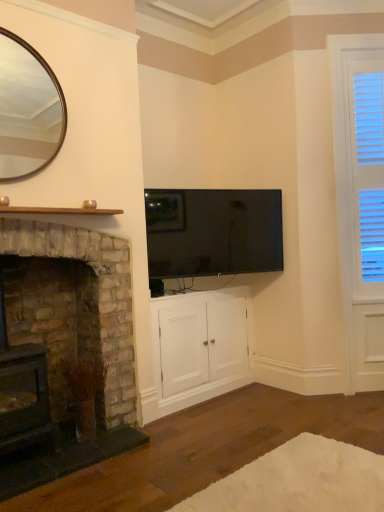
The width and height of the screenshot is (384, 512). I want to click on white wood cabinet at center, so click(x=199, y=347).

Describe the element at coordinates (70, 331) in the screenshot. I see `rustic stone fireplace at left, which is counted as the 2th fireplace, starting from the left` at that location.

This screenshot has width=384, height=512. Describe the element at coordinates (156, 287) in the screenshot. I see `black plastic phone at lower center` at that location.

What is the approximate height of gold-framed mirror at upper left?

gold-framed mirror at upper left is 33.45 inches in height.

This screenshot has height=512, width=384. I want to click on gold-framed mirror at upper left, so click(x=28, y=110).

At what (x,y) coordinates should I click in order to perform the action: click on white fluffy rug at lower center. Please return your answer as a coordinate pair (x, y). This screenshot has height=512, width=384. Looking at the image, I should click on (298, 480).

Is flat-screen black tv at upper center next to black plastic phone at lower center and touching it?

flat-screen black tv at upper center is not next to black plastic phone at lower center, and they're not touching.

Does flat-screen black tv at upper center have a lesser width compared to black plastic phone at lower center?

Yes.

Does flat-screen black tv at upper center contain black plastic phone at lower center?

No, black plastic phone at lower center is located outside of flat-screen black tv at upper center.

Is flat-screen black tv at upper center oriented away from black plastic phone at lower center?

Yes, flat-screen black tv at upper center's orientation is away from black plastic phone at lower center.

Relative to white fluffy rug at lower center, is gold-framed mirror at upper left in front or behind?

gold-framed mirror at upper left is behind white fluffy rug at lower center.

Is the surface of gold-framed mirror at upper left in direct contact with white fluffy rug at lower center?

No, gold-framed mirror at upper left is not beside white fluffy rug at lower center.

From their relative heights in the image, would you say gold-framed mirror at upper left is taller or shorter than white fluffy rug at lower center?

Considering their sizes, gold-framed mirror at upper left has more height than white fluffy rug at lower center.

Considering the relative positions of white wood blinds at right and flat-screen black tv at upper center in the image provided, is white wood blinds at right behind flat-screen black tv at upper center?

Yes.

Does white wood blinds at right turn towards flat-screen black tv at upper center?

No, white wood blinds at right is not aimed at flat-screen black tv at upper center.

Find the location of a particular element. This screenshot has height=512, width=384. window frame behind the flat-screen black tv at upper center is located at coordinates (360, 199).

Which is closer, (x=368, y=362) or (x=171, y=207)?

Point (x=368, y=362) is farther from the camera than point (x=171, y=207).

Can you confirm if rustic stone fireplace at left, acting as the second fireplace starting from the right, is positioned to the left of white fluffy rug at lower center?

Indeed, rustic stone fireplace at left, acting as the second fireplace starting from the right, is positioned on the left side of white fluffy rug at lower center.

Is rustic stone fireplace at left, the first fireplace in the left-to-right sequence, facing away from white fluffy rug at lower center?

No, rustic stone fireplace at left, the first fireplace in the left-to-right sequence,'s orientation is not away from white fluffy rug at lower center.

Considering the relative positions of rustic stone fireplace at left, acting as the second fireplace starting from the right, and white fluffy rug at lower center in the image provided, is rustic stone fireplace at left, acting as the second fireplace starting from the right, behind white fluffy rug at lower center?

Yes, it is.

Considering the sizes of flat-screen black tv at upper center and gold-framed mirror at upper left in the image, is flat-screen black tv at upper center taller or shorter than gold-framed mirror at upper left?

Considering their sizes, flat-screen black tv at upper center has less height than gold-framed mirror at upper left.

Is flat-screen black tv at upper center not near gold-framed mirror at upper left?

Yes, flat-screen black tv at upper center and gold-framed mirror at upper left are located far from each other.

Relative to gold-framed mirror at upper left, is flat-screen black tv at upper center in front or behind?

Visually, flat-screen black tv at upper center is located behind gold-framed mirror at upper left.

Does point (219, 225) appear closer or farther from the camera than point (31, 115)?

Point (219, 225) is closer to the camera than point (31, 115).

From the image's perspective, who appears lower, white fluffy rug at lower center or white wood blinds at right?

white fluffy rug at lower center appears lower in the image.

From a real-world perspective, between white fluffy rug at lower center and white wood blinds at right, who is vertically lower?

white fluffy rug at lower center, from a real-world perspective.

Does white fluffy rug at lower center have a larger size compared to white wood blinds at right?

No.

Which of these two, white fluffy rug at lower center or white wood blinds at right, stands shorter?

white fluffy rug at lower center.

The height and width of the screenshot is (512, 384). What are the coordinates of `the 1st fireplace counting from the left side of the white wood blinds at right` in the screenshot? It's located at (70, 331).

Is rustic stone fireplace at left, the 1th fireplace positioned from the right, in front of or behind white wood blinds at right in the image?

Clearly, rustic stone fireplace at left, the 1th fireplace positioned from the right, is in front of white wood blinds at right.

From the image's perspective, is rustic stone fireplace at left, which is counted as the 2th fireplace, starting from the left, located above white wood blinds at right?

No, from the image's perspective, rustic stone fireplace at left, which is counted as the 2th fireplace, starting from the left, is not on top of white wood blinds at right.

Is point (80, 250) positioned in front of point (340, 250)?

Yes, it is.

At what (x,y) coordinates should I click in order to perform the action: click on television on the right of black plastic phone at lower center. Please return your answer as a coordinate pair (x, y). Image resolution: width=384 pixels, height=512 pixels. Looking at the image, I should click on (x=213, y=232).

This screenshot has height=512, width=384. In order to click on plain that is under the gold-framed mirror at upper left (from a real-world perspective) in this screenshot , I will do [298, 480].

Looking at the image, which one is located further to rustic stone fireplace at left, the 1th fireplace positioned from the right, gold-framed mirror at upper left or rustic stone fireplace at left, the first fireplace in the left-to-right sequence?

Based on the image, gold-framed mirror at upper left appears to be further to rustic stone fireplace at left, the 1th fireplace positioned from the right.

Looking at the image, which one is located further to white wood cabinet at center, white wood blinds at right or black plastic phone at lower center?

white wood blinds at right is further to white wood cabinet at center.

Based on their spatial positions, is black plastic phone at lower center or white fluffy rug at lower center closer to rustic stone fireplace at left, acting as the second fireplace starting from the right?

Among the two, black plastic phone at lower center is located nearer to rustic stone fireplace at left, acting as the second fireplace starting from the right.

Which object lies further to the anchor point white wood blinds at right, rustic stone fireplace at left, the first fireplace in the left-to-right sequence, or flat-screen black tv at upper center?

rustic stone fireplace at left, the first fireplace in the left-to-right sequence, is positioned further to the anchor white wood blinds at right.

Estimate the real-world distances between objects in this image. Which object is closer to rustic stone fireplace at left, the 1th fireplace positioned from the right, white wood cabinet at center or black plastic phone at lower center?

white wood cabinet at center is positioned closer to the anchor rustic stone fireplace at left, the 1th fireplace positioned from the right.

Looking at the image, which one is located closer to rustic stone fireplace at left, which is counted as the 2th fireplace, starting from the left, black plastic phone at lower center or white fluffy rug at lower center?

The object closer to rustic stone fireplace at left, which is counted as the 2th fireplace, starting from the left, is black plastic phone at lower center.

When comparing their distances from white wood cabinet at center, does rustic stone fireplace at left, which is counted as the 2th fireplace, starting from the left, or black plastic phone at lower center seem further?

rustic stone fireplace at left, which is counted as the 2th fireplace, starting from the left.

Estimate the real-world distances between objects in this image. Which object is closer to white fluffy rug at lower center, white wood cabinet at center or gold-framed mirror at upper left?

The object closer to white fluffy rug at lower center is white wood cabinet at center.

The width and height of the screenshot is (384, 512). Find the location of `television between gold-framed mirror at upper left and white fluffy rug at lower center in the up-down direction`. television between gold-framed mirror at upper left and white fluffy rug at lower center in the up-down direction is located at coordinates (213, 232).

This screenshot has height=512, width=384. Identify the location of cabinetry between black plastic phone at lower center and white wood blinds at right in the horizontal direction. (199, 347).

This screenshot has height=512, width=384. In order to click on corded phone located between rustic stone fireplace at left, acting as the second fireplace starting from the right, and white wood cabinet at center in the left-right direction in this screenshot , I will do [x=156, y=287].

Locate an element on the screen. corded phone between rustic stone fireplace at left, the 1th fireplace positioned from the right, and white wood blinds at right, in the horizontal direction is located at coordinates (156, 287).